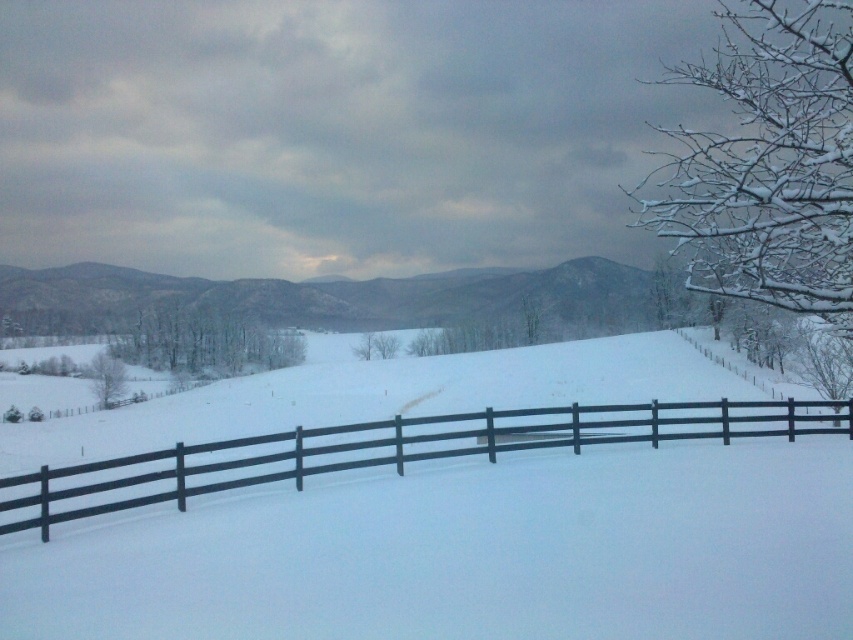
Does white matte snow at center have a lesser height compared to black wooden fence at center?

No, white matte snow at center is not shorter than black wooden fence at center.

Is white matte snow at center smaller than black wooden fence at center?

Actually, white matte snow at center might be larger than black wooden fence at center.

The height and width of the screenshot is (640, 853). Describe the element at coordinates (471, 554) in the screenshot. I see `white matte snow at center` at that location.

I want to click on white matte snow at center, so click(471, 554).